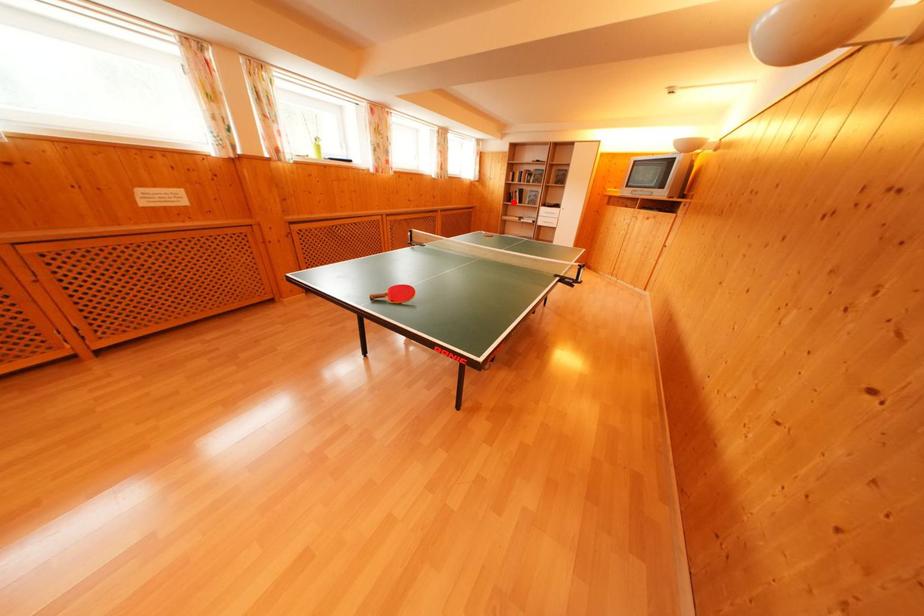
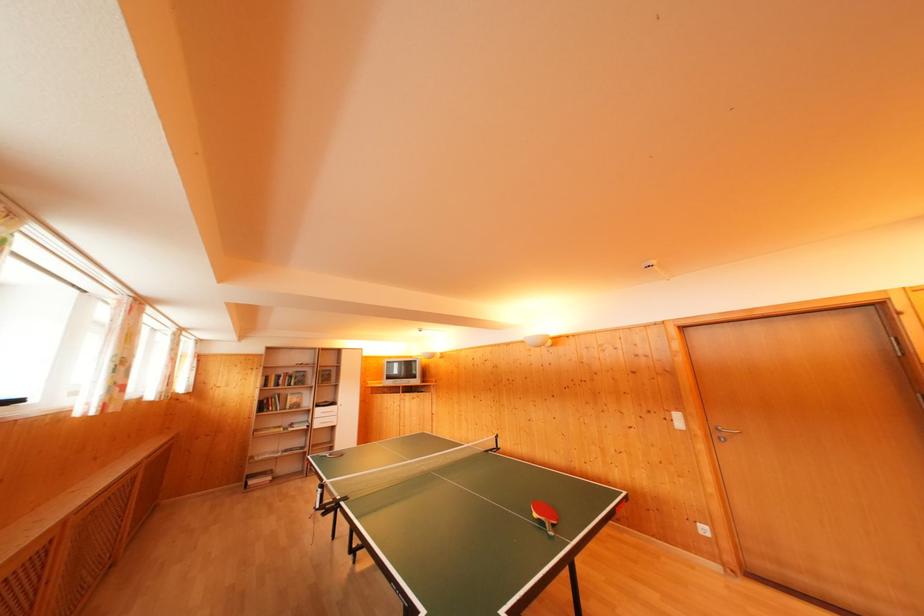
Where in the second image is the point corresponding to the highlighted location from the first image?

(268, 411)